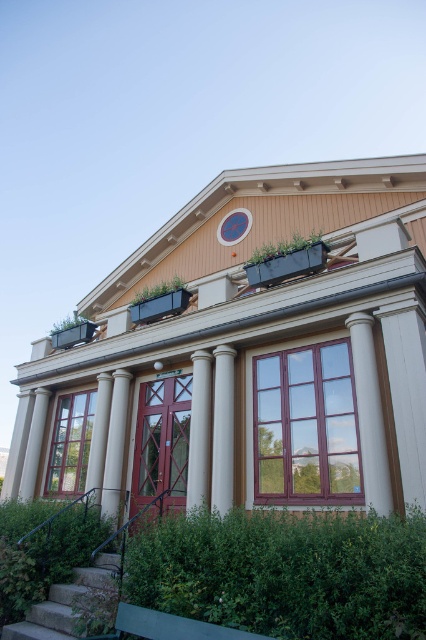
Does matte burgundy window at center appear over white smooth column at center?

Yes, matte burgundy window at center is above white smooth column at center.

Who is lower down, matte burgundy window at center or white smooth column at center?

Positioned lower is white smooth column at center.

Between point (350, 412) and point (226, 497), which one is positioned in front?

Positioned in front is point (350, 412).

Identify the location of matte burgundy window at center. The image size is (426, 640). (305, 426).

Does matte glass window at center appear over white smooth column at left?

Indeed, matte glass window at center is positioned over white smooth column at left.

Can you confirm if matte glass window at center is shorter than white smooth column at left?

Correct, matte glass window at center is not as tall as white smooth column at left.

The height and width of the screenshot is (640, 426). What are the coordinates of `matte glass window at center` in the screenshot? It's located at (69, 444).

Which of these two, green leafy hedge at lower center or stone stairs at lower left, stands shorter?

With less height is stone stairs at lower left.

Is green leafy hedge at lower center wider than stone stairs at lower left?

Indeed, green leafy hedge at lower center has a greater width compared to stone stairs at lower left.

Which is in front, point (344, 528) or point (11, 636)?

Point (344, 528) is more forward.

Identify the location of green leafy hedge at lower center. This screenshot has height=640, width=426. (284, 572).